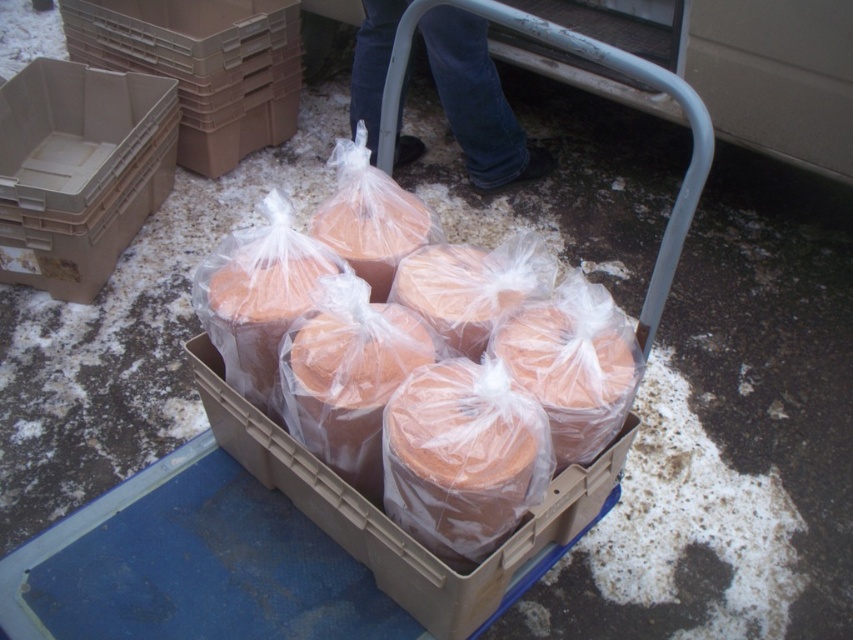
Question: Is the position of translucent plastic containers at center less distant than that of blue jeans at upper center?

Choices:
 (A) yes
 (B) no

Answer: (A)

Question: Based on their relative distances, which object is farther from the beige plastic crate at upper left?

Choices:
 (A) tan plastic crate at upper left
 (B) blue jeans at upper center
 (C) translucent plastic containers at center

Answer: (C)

Question: Among these objects, which one is nearest to the camera?

Choices:
 (A) blue jeans at upper center
 (B) translucent plastic containers at center
 (C) beige plastic crate at upper left

Answer: (B)

Question: Considering the real-world distances, which object is closest to the beige plastic crate at upper left?

Choices:
 (A) blue jeans at upper center
 (B) translucent plastic containers at center

Answer: (A)

Question: Is translucent plastic containers at center to the left of blue jeans at upper center from the viewer's perspective?

Choices:
 (A) no
 (B) yes

Answer: (B)

Question: Can you confirm if translucent plastic containers at center is positioned to the right of tan plastic crate at upper left?

Choices:
 (A) no
 (B) yes

Answer: (B)